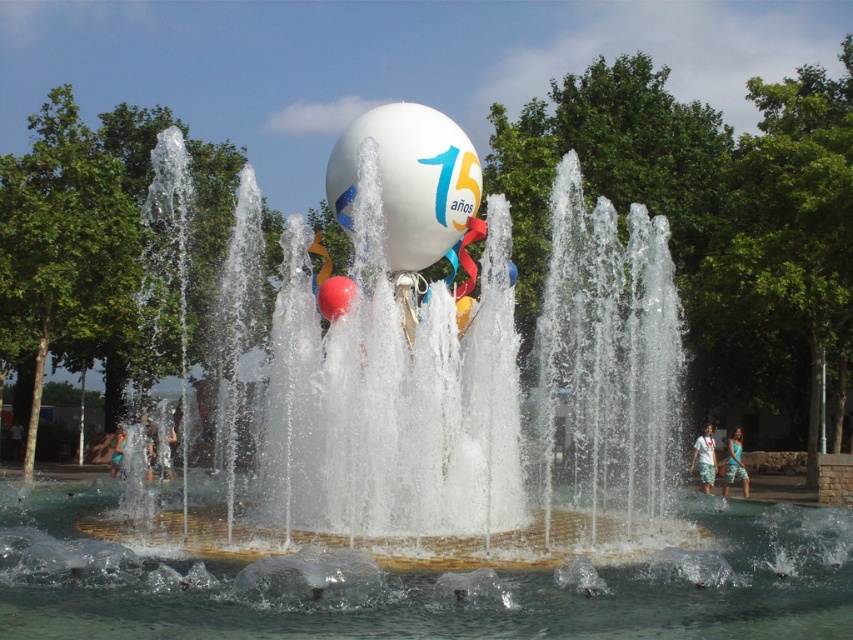
Question: Does clear water at center have a greater width compared to blue denim shorts at center?

Choices:
 (A) yes
 (B) no

Answer: (A)

Question: Does denim shorts at lower right appear over blue denim shorts at center?

Choices:
 (A) yes
 (B) no

Answer: (A)

Question: Among these points, which one is nearest to the camera?

Choices:
 (A) (323, 308)
 (B) (119, 472)

Answer: (A)

Question: Estimate the real-world distances between objects in this image. Which object is closer to the denim shorts at lower right?

Choices:
 (A) blue denim shorts at center
 (B) white cotton shirt at lower right
 (C) clear water at center

Answer: (B)

Question: Which point appears closest to the camera in this image?

Choices:
 (A) (419, 161)
 (B) (730, 467)
 (C) (325, 316)
 (D) (695, 440)

Answer: (C)

Question: Is clear water at center positioned at the back of blue denim shorts at center?

Choices:
 (A) no
 (B) yes

Answer: (A)